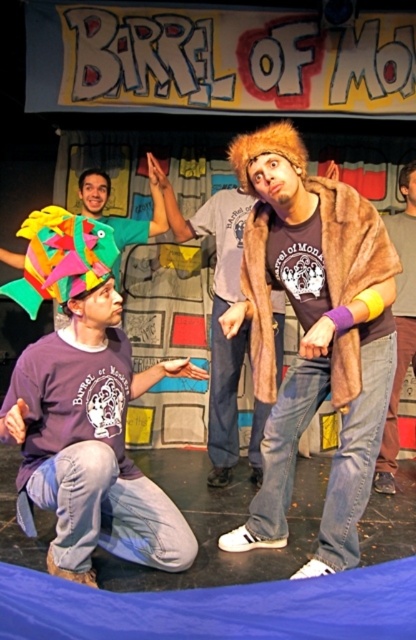
You are a stagehand preparing to adjust the lighting for the next scene of the play. The spotlight needs to be positioned exactly 2 meters away from the camera to ensure proper coverage. Given the current setup, will the fuzzy brown coat at center be illuminated by the spotlight?

The fuzzy brown coat at center is 1.93 meters from the camera, which is just under the required 2 meters. Therefore, the spotlight positioned at 2 meters would still illuminate the fuzzy brown coat at center as it is within range.